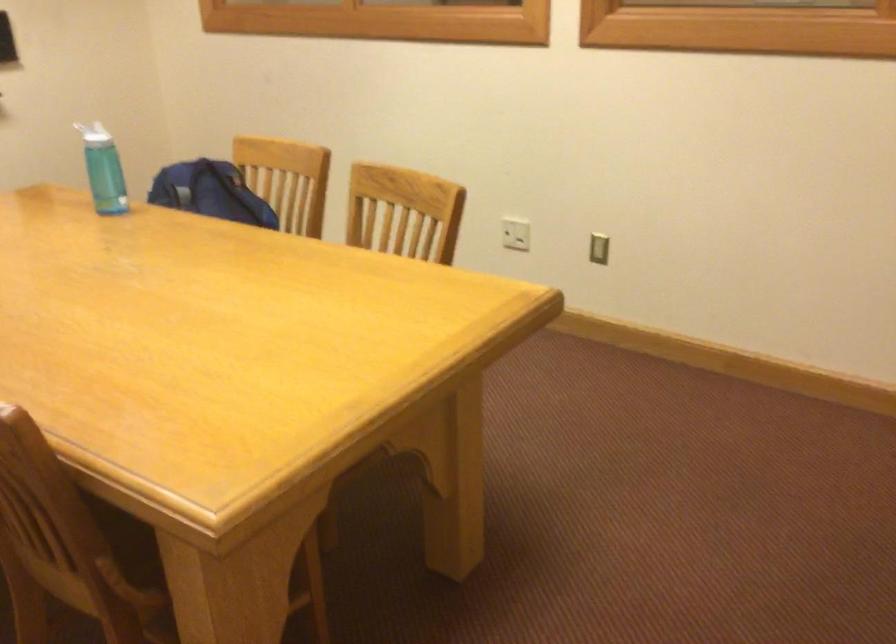
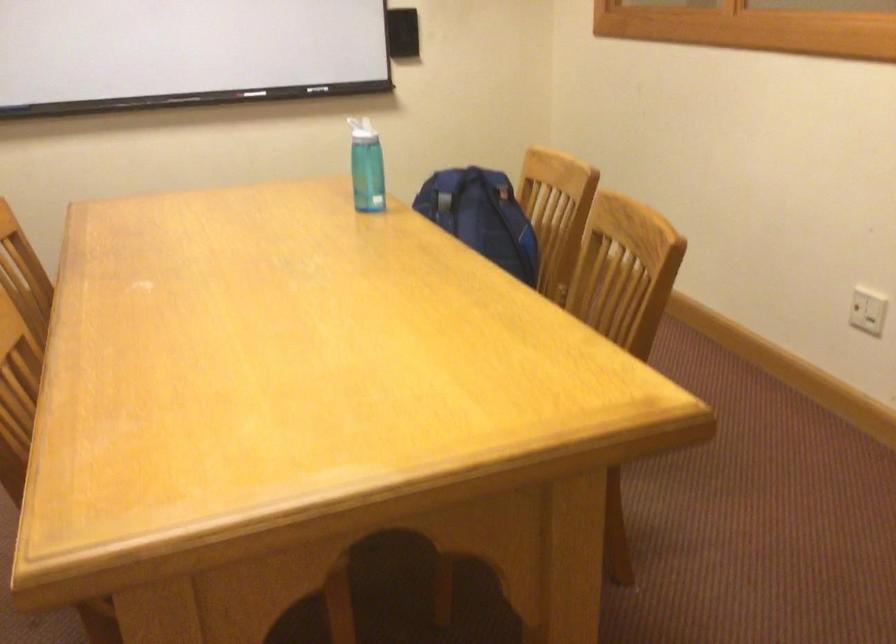
Find the pixel in the second image that matches the point at 96,131 in the first image.

(362, 129)